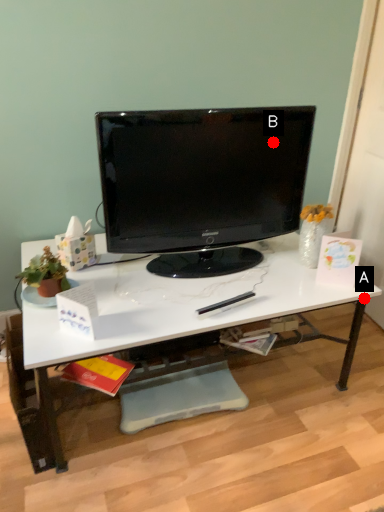
Question: Two points are circled on the image, labeled by A and B beside each circle. Which of the following is the closest to the observer?

Choices:
 (A) A is closer
 (B) B is closer

Answer: (A)